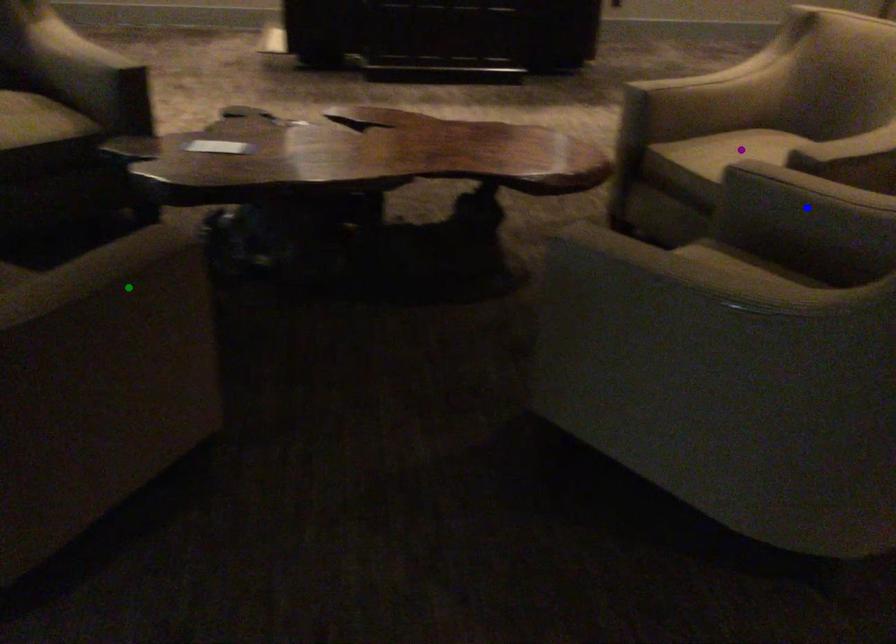
Consider the image. Order these from nearest to farthest:
green point | purple point | blue point

green point → blue point → purple point